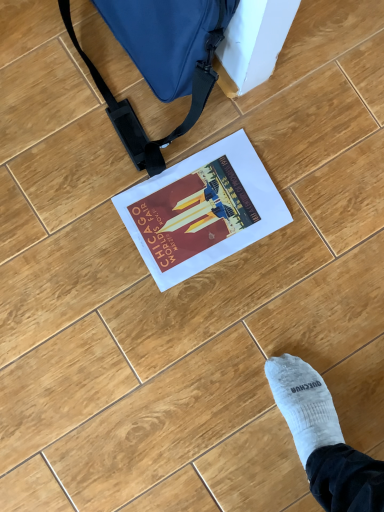
Where is `matte blue messenger bag at upper center`? This screenshot has height=512, width=384. matte blue messenger bag at upper center is located at coordinates pos(133,110).

Describe the element at coordinates (133, 110) in the screenshot. I see `matte blue messenger bag at upper center` at that location.

What is the approximate width of matte blue messenger bag at upper center?

matte blue messenger bag at upper center is 9.92 inches in width.

What is the approximate height of matte blue messenger bag at upper center?

matte blue messenger bag at upper center is 12.72 inches tall.

Identify the location of matte blue messenger bag at upper center. The width and height of the screenshot is (384, 512). (133, 110).